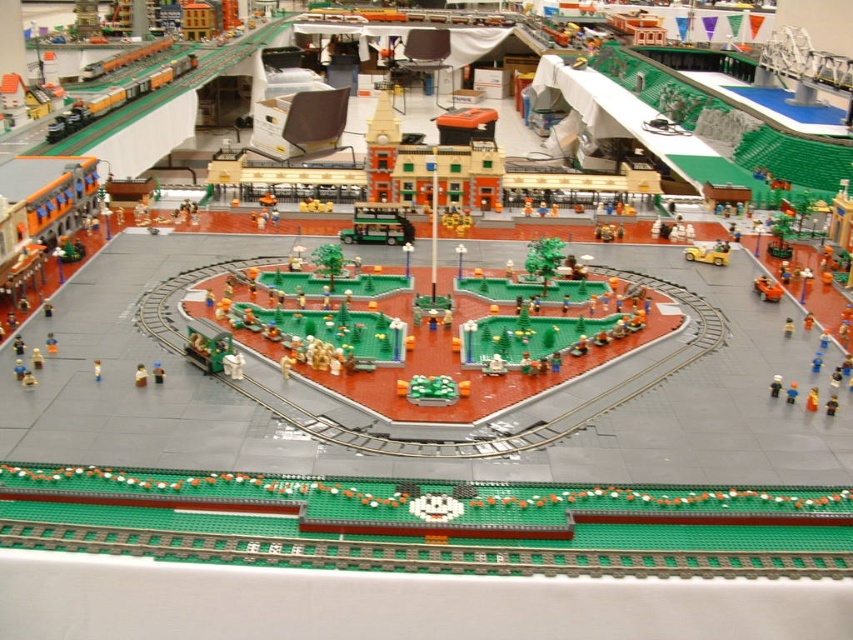
You are standing in the miniature town and want to take a photo of the green matte bus at center. If your camera has a maximum focus range of 10 feet, will you need to move closer to capture a clear image?

The green matte bus at center is 10.80 feet away from you. Since your camera can only focus up to 10 feet, you need to move closer to ensure the green matte bus at center is within the focus range.

You are a visitor in the miniature town and want to take a photo of the shiny orange car at center and the matte yellow figure at center. Which object is positioned to the right side in the image?

The shiny orange car at center is positioned to the right of the matte yellow figure at center.

You are a photographer standing in front of the miniature town model. You notice two points marked in the image. One is at coordinate point [386,216] and the other at point [100,374]. If you want to focus on the point that is closer to you, which coordinate should you adjust your camera to aim at?

Point [100,374] is closer to you than point [386,216], so you should adjust your camera to aim at point [100,374].